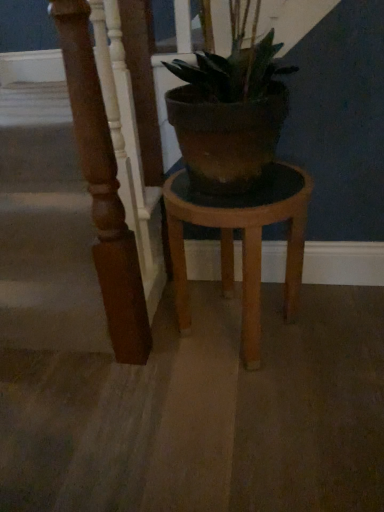
Question: Does point (61, 40) appear closer or farther from the camera than point (226, 229)?

Choices:
 (A) closer
 (B) farther

Answer: (A)

Question: In the image, is brown polished wood pillar at left positioned in front of or behind wooden stool at center?

Choices:
 (A) behind
 (B) front

Answer: (B)

Question: Considering the positions of brown polished wood pillar at left and wooden stool at center in the image, is brown polished wood pillar at left wider or thinner than wooden stool at center?

Choices:
 (A) thin
 (B) wide

Answer: (A)

Question: From a real-world perspective, relative to brown polished wood pillar at left, is wooden stool at center vertically above or below?

Choices:
 (A) below
 (B) above

Answer: (A)

Question: Considering the positions of wooden stool at center and brown polished wood pillar at left in the image, is wooden stool at center wider or thinner than brown polished wood pillar at left?

Choices:
 (A) wide
 (B) thin

Answer: (A)

Question: Considering their positions, is wooden stool at center located in front of or behind brown polished wood pillar at left?

Choices:
 (A) behind
 (B) front

Answer: (A)

Question: Considering the relative positions of wooden stool at center and brown polished wood pillar at left in the image provided, is wooden stool at center to the left or to the right of brown polished wood pillar at left?

Choices:
 (A) right
 (B) left

Answer: (A)